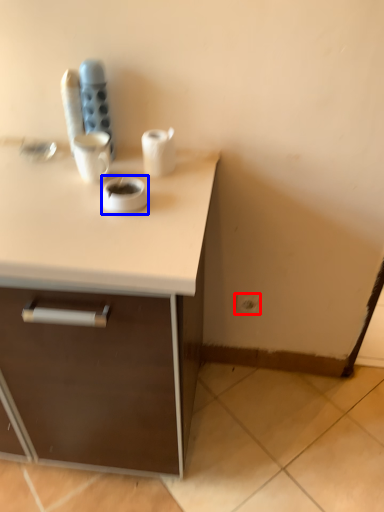
Question: Which point is further to the camera, electric outlet (highlighted by a red box) or coffee (highlighted by a blue box)?

Choices:
 (A) electric outlet
 (B) coffee

Answer: (A)